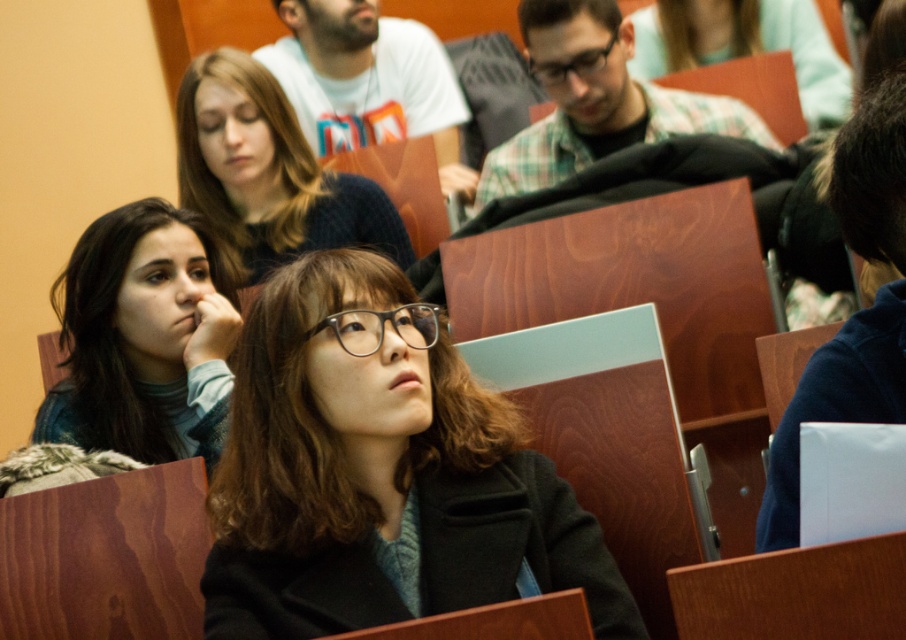
Question: Which of the following is the closest to the observer?

Choices:
 (A) (278, 508)
 (B) (603, 48)
 (C) (358, 340)
 (D) (112, 292)

Answer: (A)

Question: Can you confirm if clear plastic glasses at center is wider than black plastic glasses at center?

Choices:
 (A) yes
 (B) no

Answer: (B)

Question: Among these objects, which one is nearest to the camera?

Choices:
 (A) clear plastic glasses at center
 (B) light blue sweater at left
 (C) dark brown sweater at upper center

Answer: (A)

Question: Is black matte jacket at center in front of dark brown sweater at upper center?

Choices:
 (A) yes
 (B) no

Answer: (A)

Question: Does light blue sweater at left appear under black plastic glasses at center?

Choices:
 (A) no
 (B) yes

Answer: (B)

Question: Which point appears farthest from the camera in this image?

Choices:
 (A) (184, 243)
 (B) (603, 51)
 (C) (374, 312)

Answer: (B)